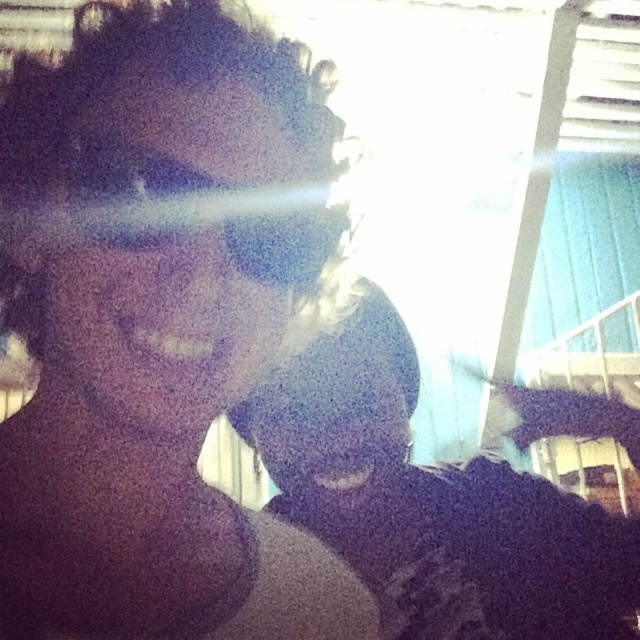
Question: Estimate the real-world distances between objects in this image. Which object is closer to the matte black goggles at center?

Choices:
 (A) dark fabric at center
 (B) matte black hair at upper left

Answer: (B)

Question: Which of the following is the farthest from the observer?

Choices:
 (A) matte black goggles at center
 (B) matte black hair at upper left
 (C) dark fabric at center

Answer: (C)

Question: Can you confirm if matte black hair at upper left is bigger than matte black goggles at center?

Choices:
 (A) no
 (B) yes

Answer: (B)

Question: Is matte black hair at upper left to the right of dark fabric at center from the viewer's perspective?

Choices:
 (A) no
 (B) yes

Answer: (A)

Question: Which of the following is the farthest from the observer?

Choices:
 (A) matte black hair at upper left
 (B) dark fabric at center

Answer: (B)

Question: Does matte black hair at upper left have a smaller size compared to matte black goggles at center?

Choices:
 (A) no
 (B) yes

Answer: (A)